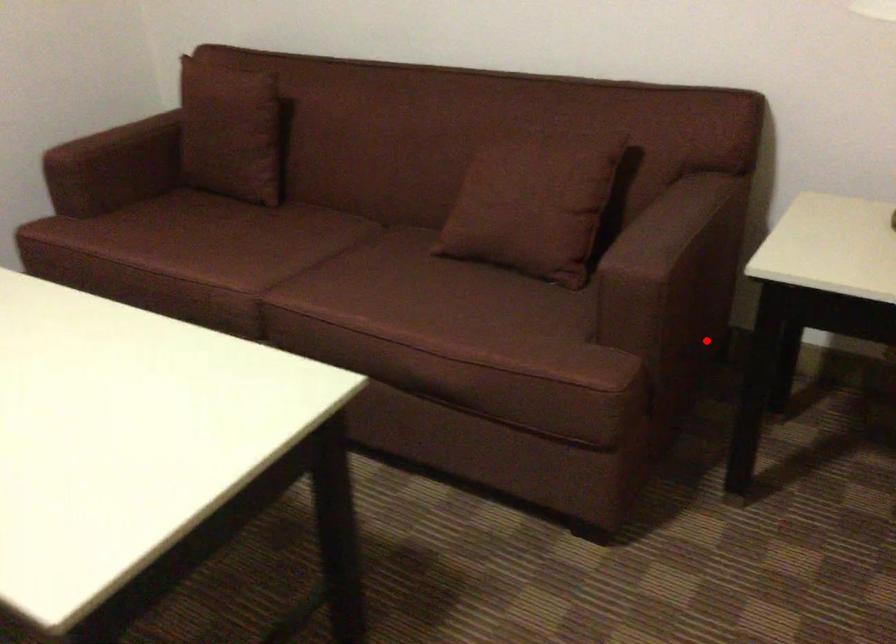
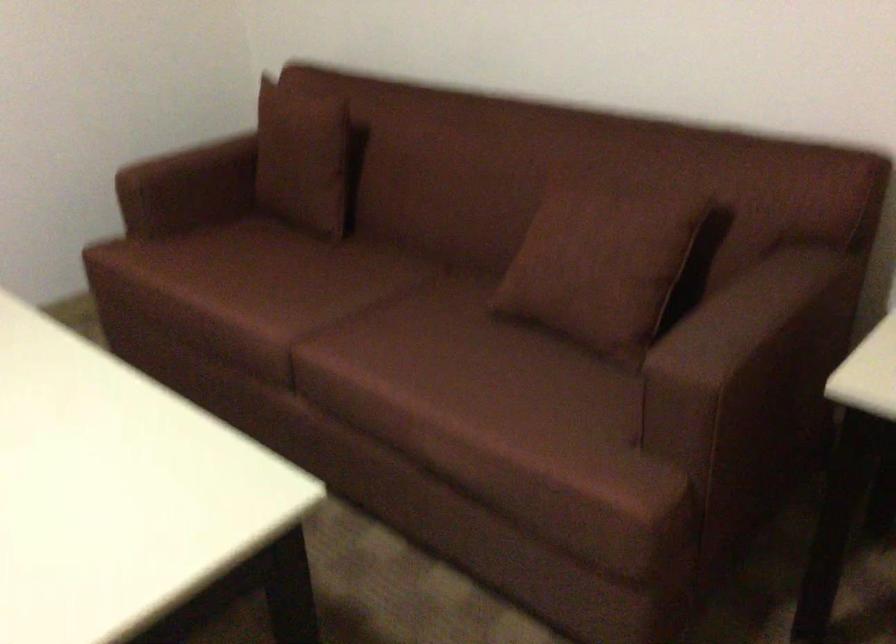
Locate, in the second image, the point that corresponds to the highlighted location in the first image.

(791, 446)